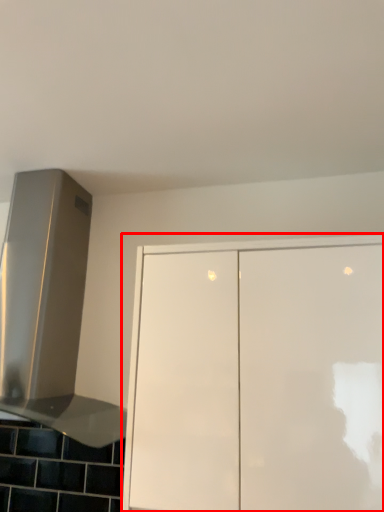
Question: Where is cabinetry (annotated by the red box) located in relation to vent in the image?

Choices:
 (A) left
 (B) right

Answer: (B)